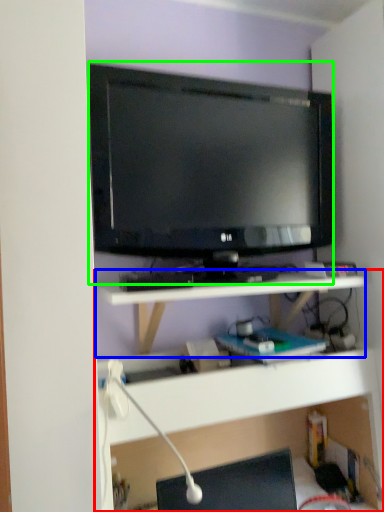
Question: Which object is the farthest from shelf (highlighted by a red box)? Choose among these: shelf (highlighted by a blue box) or television (highlighted by a green box).

Choices:
 (A) shelf
 (B) television

Answer: (B)